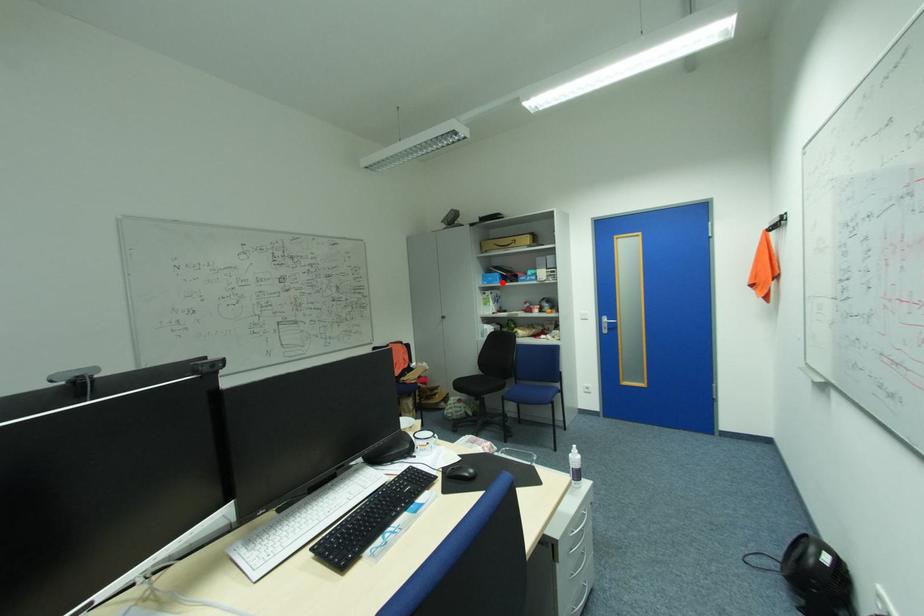
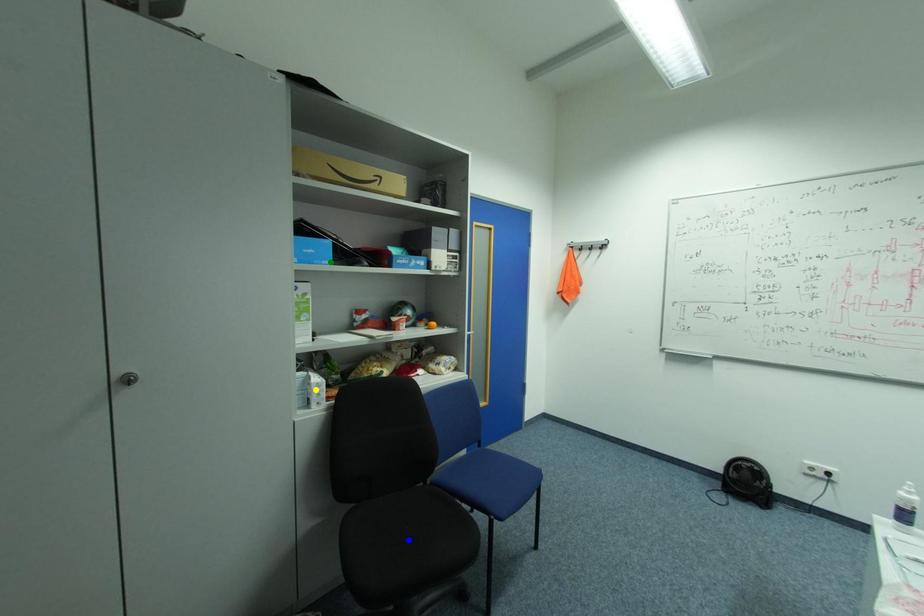
Question: I am providing you with two images of the same scene from different viewpoints. A red point is marked on the first image. You are given multiple points on the second image. In image 2, which mark is for the same physical point as the one in image 1?

Choices:
 (A) green point
 (B) yellow point
 (C) blue point

Answer: (A)